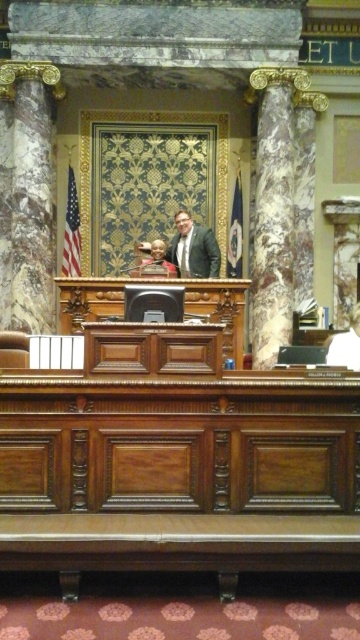
Does marble column at right appear under matte black suit at center?

No.

Between marble column at right and matte black suit at center, which one has less height?

With less height is matte black suit at center.

Between point (276, 300) and point (218, 244), which one is positioned behind?

The point (218, 244) is more distant.

Image resolution: width=360 pixels, height=640 pixels. Identify the location of marble column at right. (272, 216).